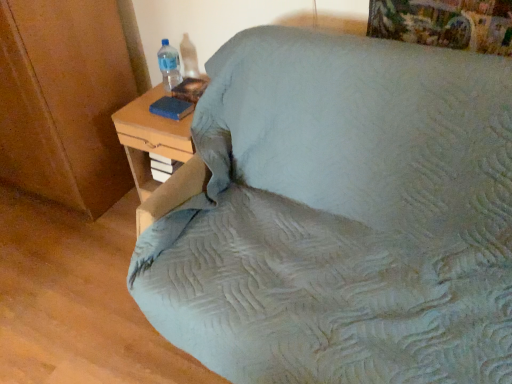
In order to face light blue fabric bed at center, should I rotate leftwards or rightwards?

Turn right by 9.793 degrees to look at light blue fabric bed at center.

Where is `transparent plastic bottle at upper left`? transparent plastic bottle at upper left is located at coordinates 169,65.

Image resolution: width=512 pixels, height=384 pixels. Find the location of `light blue fabric bed at center`. light blue fabric bed at center is located at coordinates (342, 216).

Is transparent plastic bottle at upper left directly adjacent to woodennightstand at right?

transparent plastic bottle at upper left and woodennightstand at right are not in contact.

In the image, is transparent plastic bottle at upper left positioned in front of or behind woodennightstand at right?

In the image, transparent plastic bottle at upper left appears behind woodennightstand at right.

Is transparent plastic bottle at upper left inside the boundaries of woodennightstand at right, or outside?

transparent plastic bottle at upper left is outside woodennightstand at right.

Are woodennightstand at right and transparent plastic bottle at upper left located far from each other?

No, there isn't a large distance between woodennightstand at right and transparent plastic bottle at upper left.

From a real-world perspective, is woodennightstand at right positioned over transparent plastic bottle at upper left based on gravity?

No, from a real-world perspective, woodennightstand at right is not on top of transparent plastic bottle at upper left.

Is woodennightstand at right to the left of transparent plastic bottle at upper left from the viewer's perspective?

No.

Is woodennightstand at right closer to camera compared to transparent plastic bottle at upper left?

Yes, it is.

Is light blue fabric bed at center situated inside transparent plastic bottle at upper left or outside?

light blue fabric bed at center is located beyond the bounds of transparent plastic bottle at upper left.

At what (x,y) coordinates should I click in order to perform the action: click on furniture in front of the transparent plastic bottle at upper left. Please return your answer as a coordinate pair (x, y). The width and height of the screenshot is (512, 384). Looking at the image, I should click on (342, 216).

How distant is light blue fabric bed at center from transparent plastic bottle at upper left?

light blue fabric bed at center and transparent plastic bottle at upper left are 93.61 centimeters apart from each other.

From the image's perspective, which object appears higher, light blue fabric bed at center or transparent plastic bottle at upper left?

transparent plastic bottle at upper left appears higher in the image.

Consider the image. Considering the sizes of objects blue matte book at upper left and light blue fabric bed at center in the image provided, who is bigger, blue matte book at upper left or light blue fabric bed at center?

With larger size is light blue fabric bed at center.

From a real-world perspective, does blue matte book at upper left stand above light blue fabric bed at center?

Correct, in the physical world, blue matte book at upper left is higher than light blue fabric bed at center.

Is blue matte book at upper left wider or thinner than light blue fabric bed at center?

In the image, blue matte book at upper left appears to be more narrow than light blue fabric bed at center.

Looking at this image, is blue matte book at upper left positioned beyond the bounds of light blue fabric bed at center?

Indeed, blue matte book at upper left is completely outside light blue fabric bed at center.

Does blue matte book at upper left appear on the left side of woodennightstand at right?

Indeed, blue matte book at upper left is positioned on the left side of woodennightstand at right.

Looking at this image, considering the sizes of objects blue matte book at upper left and woodennightstand at right in the image provided, who is shorter, blue matte book at upper left or woodennightstand at right?

With less height is blue matte book at upper left.

You are a GUI agent. You are given a task and a screenshot of the screen. Output one action in this format:
    pyautogui.click(x=<x>, y=<y>)
    Task: Click on the nightstand below the blue matte book at upper left (from the image's perspective)
    
    Given the screenshot: What is the action you would take?
    pyautogui.click(x=151, y=138)

How many degrees apart are the facing directions of blue matte book at upper left and woodennightstand at right?

2.53 degrees.

Considering the relative positions of transparent plastic bottle at upper left and blue matte book at upper left in the image provided, is transparent plastic bottle at upper left to the left of blue matte book at upper left from the viewer's perspective?

Correct, you'll find transparent plastic bottle at upper left to the left of blue matte book at upper left.

Would you consider transparent plastic bottle at upper left to be distant from blue matte book at upper left?

They are positioned close to each other.

What's the angular difference between transparent plastic bottle at upper left and blue matte book at upper left's facing directions?

The angular difference between transparent plastic bottle at upper left and blue matte book at upper left is 0.000315 degrees.

From the image's perspective, is light blue fabric bed at center above blue matte book at upper left?

No, from the image's perspective, light blue fabric bed at center is not over blue matte book at upper left.

Which object is more forward, light blue fabric bed at center or blue matte book at upper left?

light blue fabric bed at center is in front.

Consider the image. From a real-world perspective, is light blue fabric bed at center above or below blue matte book at upper left?

light blue fabric bed at center is below blue matte book at upper left.

There is a woodennightstand at right. Where is `bottle above it (from a real-world perspective)`? The height and width of the screenshot is (384, 512). bottle above it (from a real-world perspective) is located at coordinates (169, 65).

Identify the location of bottle that is above the woodennightstand at right (from the image's perspective). (169, 65).

When comparing their distances from light blue fabric bed at center, does blue matte book at upper left or transparent plastic bottle at upper left seem closer?

Based on the image, blue matte book at upper left appears to be nearer to light blue fabric bed at center.

Looking at the image, which one is located further to light blue fabric bed at center, blue matte book at upper left or woodennightstand at right?

Based on the image, blue matte book at upper left appears to be further to light blue fabric bed at center.

Estimate the real-world distances between objects in this image. Which object is closer to transparent plastic bottle at upper left, woodennightstand at right or light blue fabric bed at center?

woodennightstand at right lies closer to transparent plastic bottle at upper left than the other object.

From the image, which object appears to be nearer to woodennightstand at right, blue matte book at upper left or light blue fabric bed at center?

Based on the image, blue matte book at upper left appears to be nearer to woodennightstand at right.

Estimate the real-world distances between objects in this image. Which object is further from woodennightstand at right, transparent plastic bottle at upper left or light blue fabric bed at center?

Among the two, light blue fabric bed at center is located further to woodennightstand at right.

Looking at the image, which one is located closer to transparent plastic bottle at upper left, blue matte book at upper left or light blue fabric bed at center?

blue matte book at upper left is closer to transparent plastic bottle at upper left.

From the image, which object appears to be nearer to blue matte book at upper left, woodennightstand at right or light blue fabric bed at center?

woodennightstand at right is positioned closer to the anchor blue matte book at upper left.

From the image, which object appears to be nearer to transparent plastic bottle at upper left, blue matte book at upper left or woodennightstand at right?

blue matte book at upper left lies closer to transparent plastic bottle at upper left than the other object.

Locate an element on the screen. The height and width of the screenshot is (384, 512). pad between light blue fabric bed at center and transparent plastic bottle at upper left from front to back is located at coordinates (172, 108).

The height and width of the screenshot is (384, 512). What are the coordinates of `nightstand positioned between light blue fabric bed at center and transparent plastic bottle at upper left from near to far` in the screenshot? It's located at (151, 138).

At what (x,y) coordinates should I click in order to perform the action: click on nightstand between light blue fabric bed at center and blue matte book at upper left along the z-axis. Please return your answer as a coordinate pair (x, y). The width and height of the screenshot is (512, 384). Looking at the image, I should click on (151, 138).

Identify the location of pad between transparent plastic bottle at upper left and woodennightstand at right vertically. (172, 108).